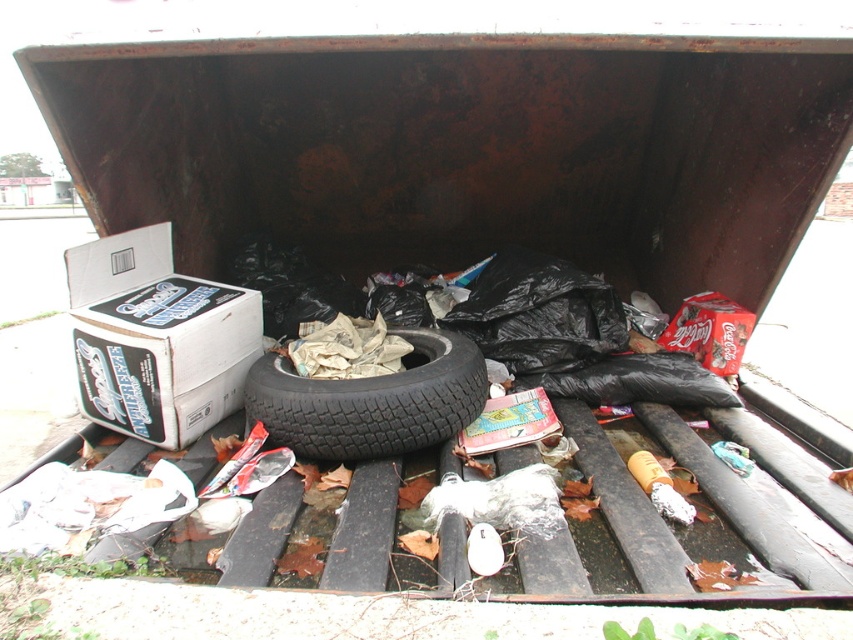
You are a sanitation worker who needs to determine if the white cardboard box at left can be stacked on top of the black rubber tire at center without exceeding the height limit of the dumpster. Can you confirm if this is possible?

The white cardboard box at left is taller than the black rubber tire at center, so stacking it on top would exceed the height limit of the dumpster.

Based on the photo, you are a waste management worker who needs to identify items in the dumpster. You see the white cardboard box at left and the black rubber tire at center. Which item is bigger?

The white cardboard box at left is larger in size than the black rubber tire at center.